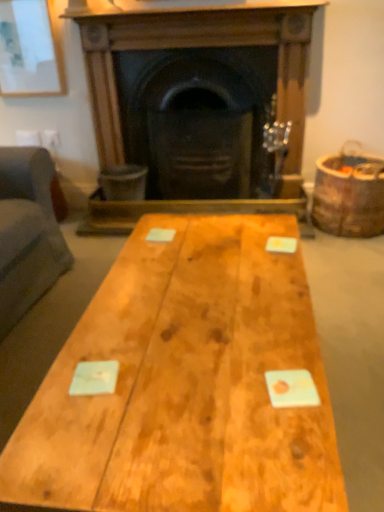
I want to click on blank space above natural wood table at center (from a real-world perspective), so click(197, 318).